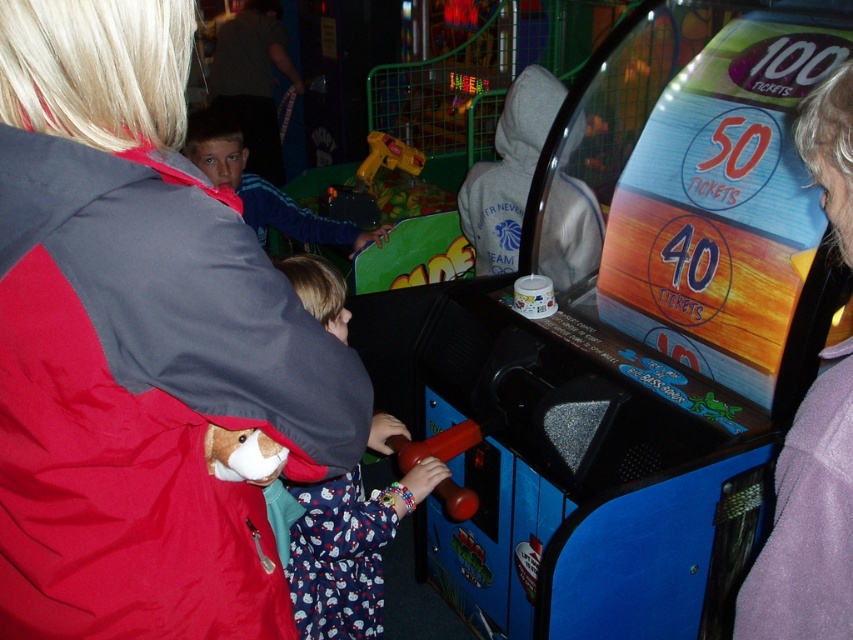
Question: Which of the following is the closest to the observer?

Choices:
 (A) (437, 442)
 (B) (323, 630)

Answer: (A)

Question: Is flannel pajamas at center thinner than rubberized red handle at center?

Choices:
 (A) no
 (B) yes

Answer: (A)

Question: Does purple fleece jacket at lower right have a larger size compared to flannel pajamas at center?

Choices:
 (A) no
 (B) yes

Answer: (A)

Question: In this image, where is flannel pajamas at center located relative to yellow plastic toy gun at center?

Choices:
 (A) left
 (B) right

Answer: (B)

Question: Among these points, which one is nearest to the camera?

Choices:
 (A) (338, 211)
 (B) (312, 304)
 (C) (456, 426)
 (D) (276, 595)

Answer: (D)

Question: Considering the real-world distances, which object is closest to the rubberized red handle at center?

Choices:
 (A) purple fleece jacket at lower right
 (B) flannel pajamas at center
 (C) matte gray jacket at center

Answer: (B)